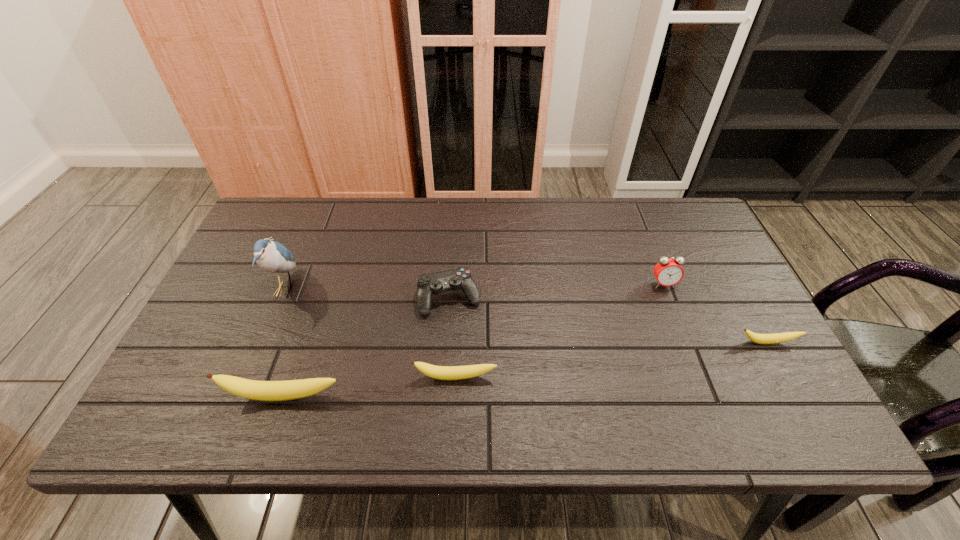
This screenshot has width=960, height=540. I want to click on the nearest object, so click(251, 389).

Find the location of a particular element. Image resolution: width=960 pixels, height=540 pixels. the nearest banana is located at coordinates (251, 389).

This screenshot has width=960, height=540. Identify the location of the second shortest banana. (437, 372).

Locate an element on the screen. Image resolution: width=960 pixels, height=540 pixels. the second nearest object is located at coordinates (437, 372).

What are the coordinates of `the shortest object` in the screenshot? It's located at (757, 338).

This screenshot has width=960, height=540. I want to click on the shortest banana, so click(x=757, y=338).

Locate an element on the screen. bird is located at coordinates (271, 256).

Where is `the fifth object from left to right`? The width and height of the screenshot is (960, 540). the fifth object from left to right is located at coordinates (668, 271).

Identify the location of control. Image resolution: width=960 pixels, height=540 pixels. (460, 278).

The height and width of the screenshot is (540, 960). In order to click on vacant region located 0.120m on the upward curve of the farthest banana in this screenshot , I will do `click(794, 391)`.